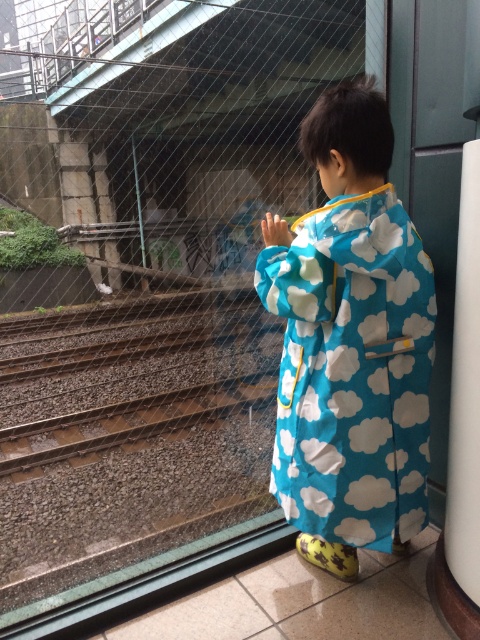
Between blue fabric raincoat at center and white smooth pillar at right, which one appears on the left side from the viewer's perspective?

blue fabric raincoat at center is more to the left.

This screenshot has height=640, width=480. What do you see at coordinates (350, 342) in the screenshot? I see `blue fabric raincoat at center` at bounding box center [350, 342].

Is point (358, 493) farther from camera compared to point (468, 522)?

Yes, it is behind point (468, 522).

You are a GUI agent. You are given a task and a screenshot of the screen. Output one action in this format:
    pyautogui.click(x=<x>, y=<y>)
    Task: Click on the blue fabric raincoat at center
    
    Given the screenshot: What is the action you would take?
    pyautogui.click(x=350, y=342)